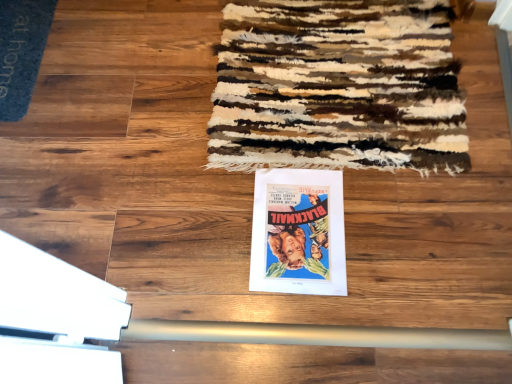
Question: Is matte paper poster at center closer to camera compared to blue carpet at upper left?

Choices:
 (A) no
 (B) yes

Answer: (B)

Question: From the image's perspective, is matte paper poster at center under blue carpet at upper left?

Choices:
 (A) no
 (B) yes

Answer: (B)

Question: Is blue carpet at upper left inside matte paper poster at center?

Choices:
 (A) yes
 (B) no

Answer: (B)

Question: From a real-world perspective, is matte paper poster at center positioned over blue carpet at upper left based on gravity?

Choices:
 (A) no
 (B) yes

Answer: (A)

Question: Is matte paper poster at center far from blue carpet at upper left?

Choices:
 (A) no
 (B) yes

Answer: (A)

Question: Is matte paper poster at center next to blue carpet at upper left?

Choices:
 (A) yes
 (B) no

Answer: (B)

Question: Does textured woolen mat at upper center have a greater width compared to blue carpet at upper left?

Choices:
 (A) yes
 (B) no

Answer: (A)

Question: Is textured woolen mat at upper center thinner than blue carpet at upper left?

Choices:
 (A) yes
 (B) no

Answer: (B)

Question: Can you confirm if textured woolen mat at upper center is taller than blue carpet at upper left?

Choices:
 (A) no
 (B) yes

Answer: (B)

Question: From a real-world perspective, is textured woolen mat at upper center under blue carpet at upper left?

Choices:
 (A) yes
 (B) no

Answer: (B)

Question: From the image's perspective, does textured woolen mat at upper center appear lower than blue carpet at upper left?

Choices:
 (A) yes
 (B) no

Answer: (A)

Question: Does textured woolen mat at upper center lie in front of blue carpet at upper left?

Choices:
 (A) yes
 (B) no

Answer: (A)

Question: From a real-world perspective, is blue carpet at upper left located higher than matte paper poster at center?

Choices:
 (A) yes
 (B) no

Answer: (A)